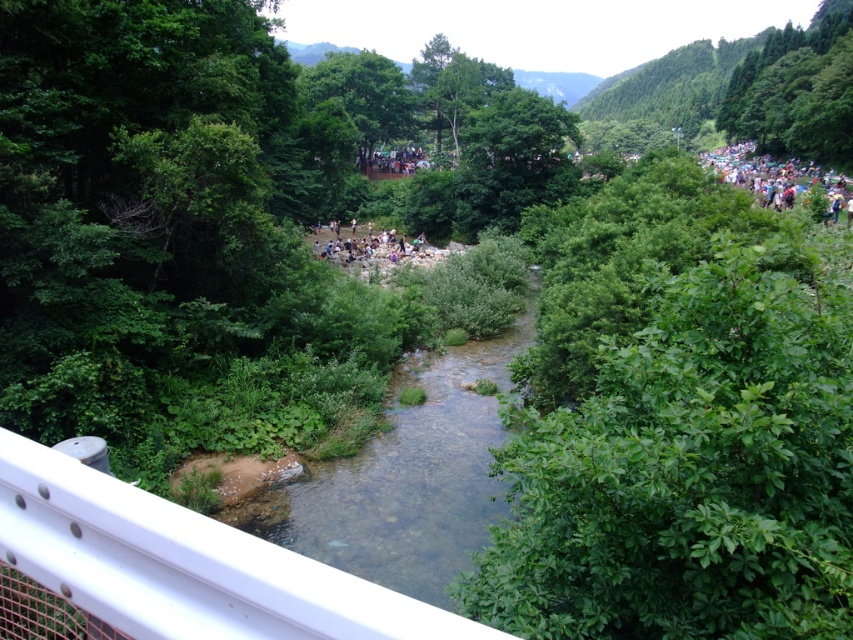
Locate an element on the screen. The height and width of the screenshot is (640, 853). white metallic rail at lower left is located at coordinates (184, 564).

Is white metallic rail at lower left thinner than multicolored fabric crowd at upper right?

Yes, white metallic rail at lower left is thinner than multicolored fabric crowd at upper right.

The image size is (853, 640). What do you see at coordinates (184, 564) in the screenshot?
I see `white metallic rail at lower left` at bounding box center [184, 564].

This screenshot has height=640, width=853. In order to click on white metallic rail at lower left in this screenshot , I will do `click(184, 564)`.

Can you confirm if white metallic rail at lower left is positioned to the left of dark green foliage at center?

No, white metallic rail at lower left is not to the left of dark green foliage at center.

Identify the location of white metallic rail at lower left. (184, 564).

Who is more forward, (86, 584) or (386, 250)?

Point (86, 584)

Where is `white metallic rail at lower left`? Image resolution: width=853 pixels, height=640 pixels. white metallic rail at lower left is located at coordinates (184, 564).

Does clear water at center have a smaller size compared to multicolored fabric crowd at upper right?

Yes, clear water at center is smaller than multicolored fabric crowd at upper right.

Is clear water at center thinner than multicolored fabric crowd at upper right?

Yes.

Which is in front, point (416, 433) or point (717, 179)?

Point (416, 433) is more forward.

Where is `clear water at center`? clear water at center is located at coordinates (405, 477).